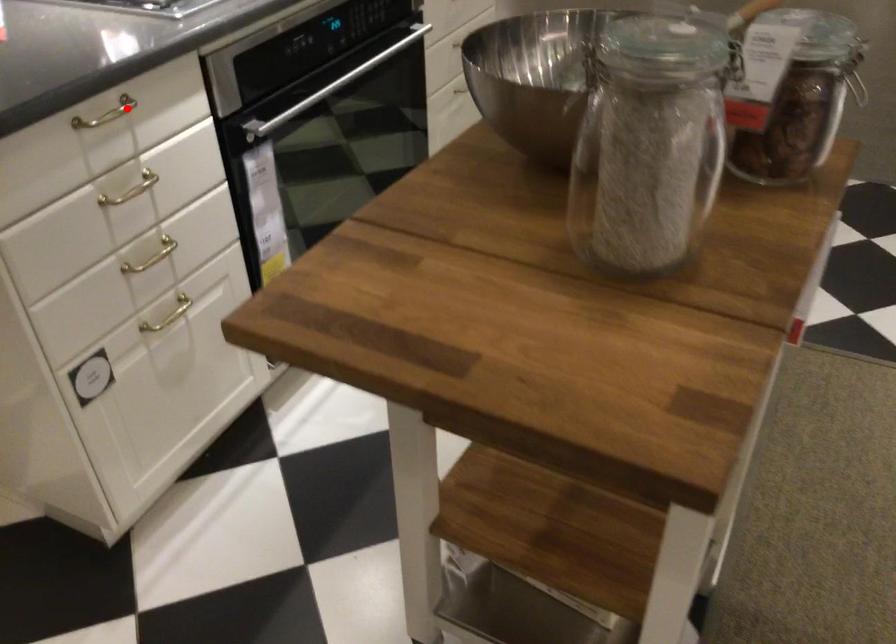
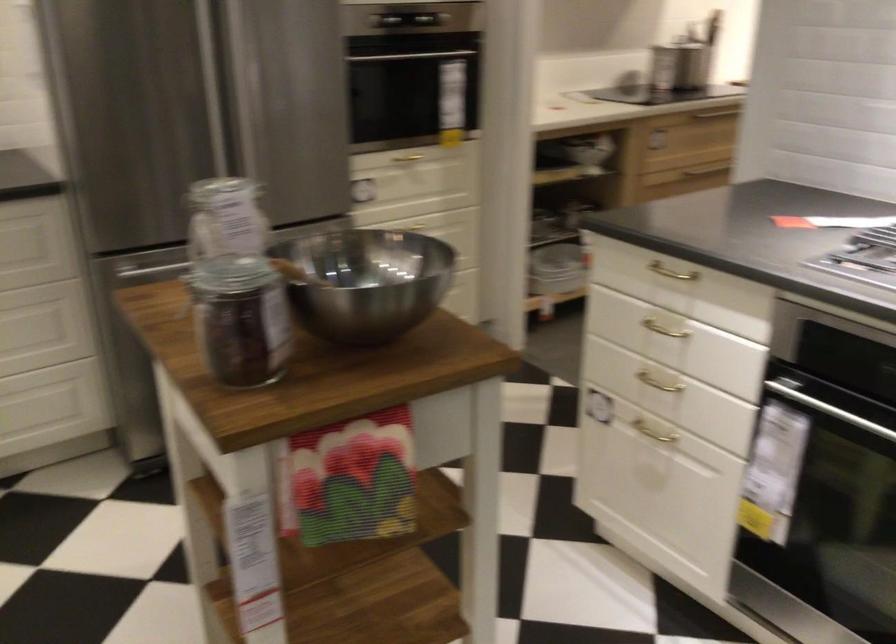
Question: I am providing you with two images of the same scene from different viewpoints. A red point is shown in image1. For the corresponding object point in image2, is it positioned nearer or farther from the camera?

Choices:
 (A) Nearer
 (B) Farther

Answer: (B)